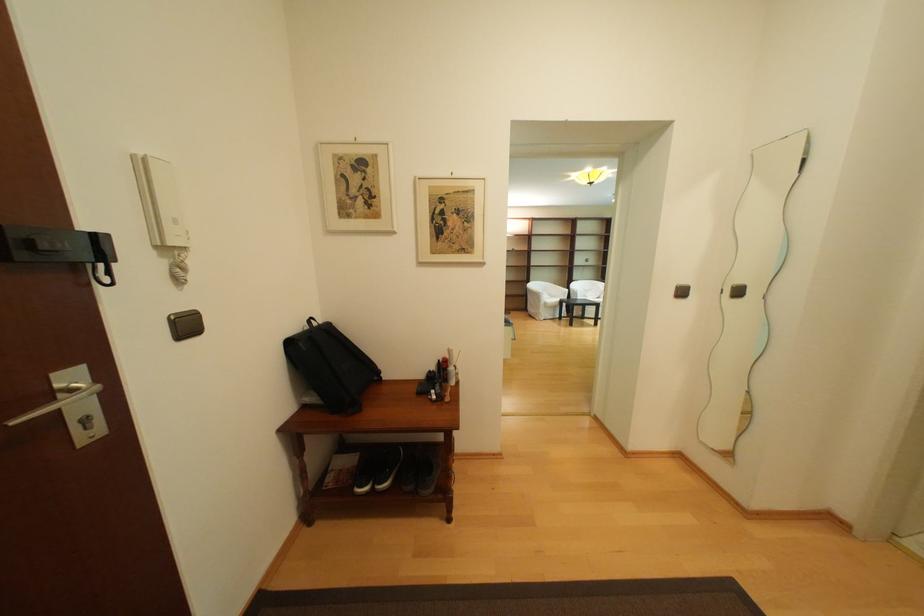
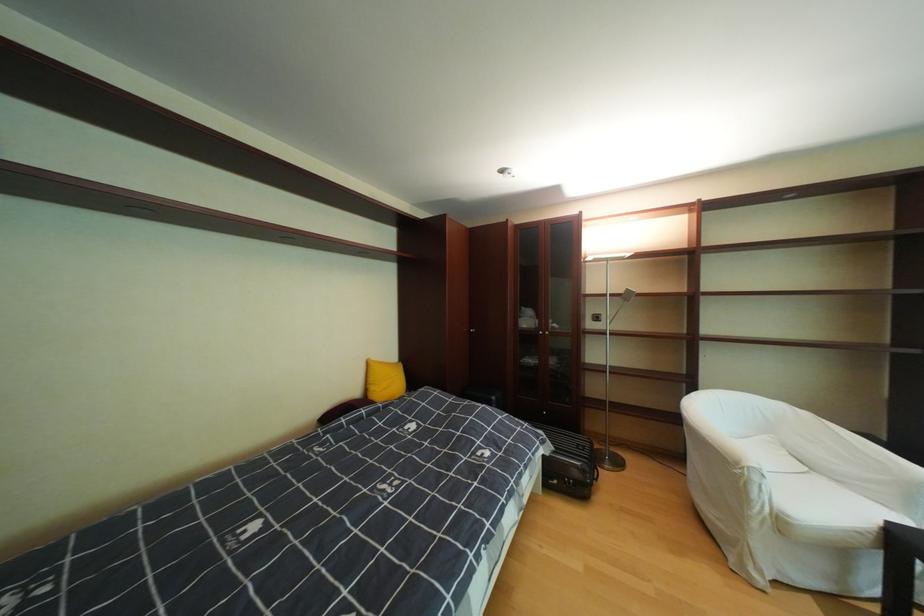
In the second image, find the point that corresponds to (x=560, y=285) in the first image.

(793, 407)